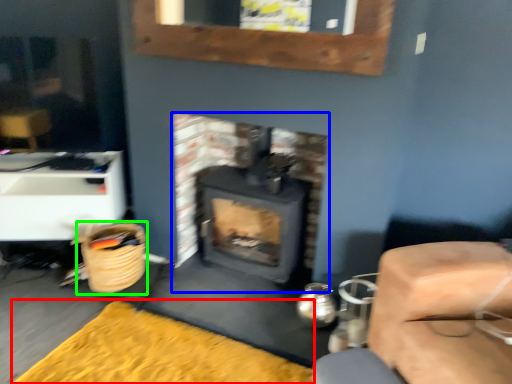
Question: Which object is the farthest from doormat (highlighted by a red box)? Choose among these: wood burning stove (highlighted by a blue box) or basket (highlighted by a green box).

Choices:
 (A) wood burning stove
 (B) basket

Answer: (A)